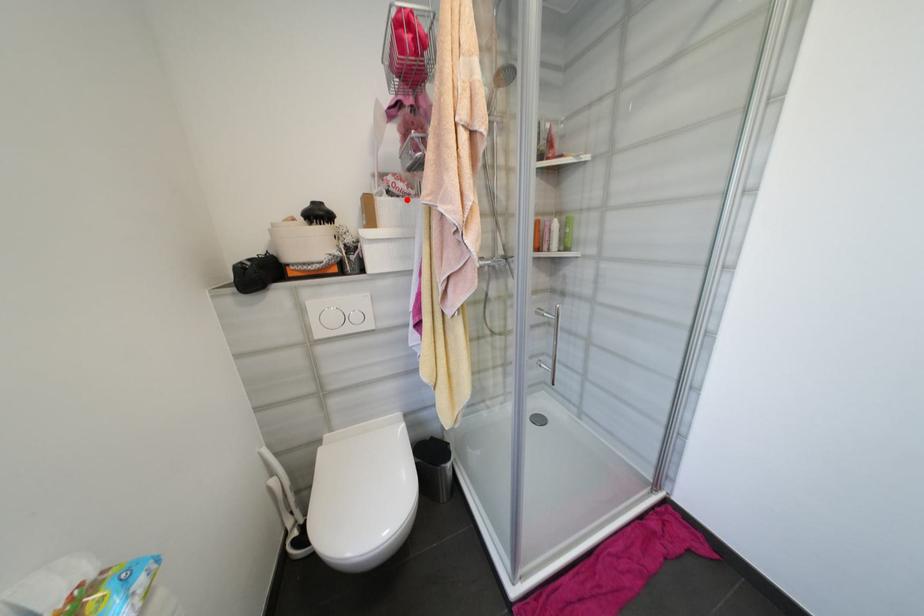
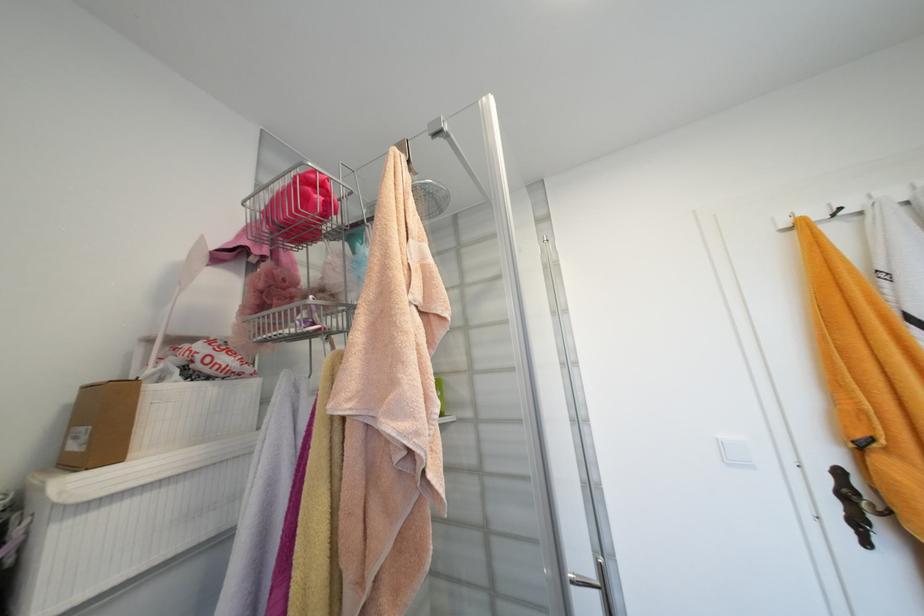
Where in the second image is the point corresponding to the highlighted location from the first image?

(224, 383)